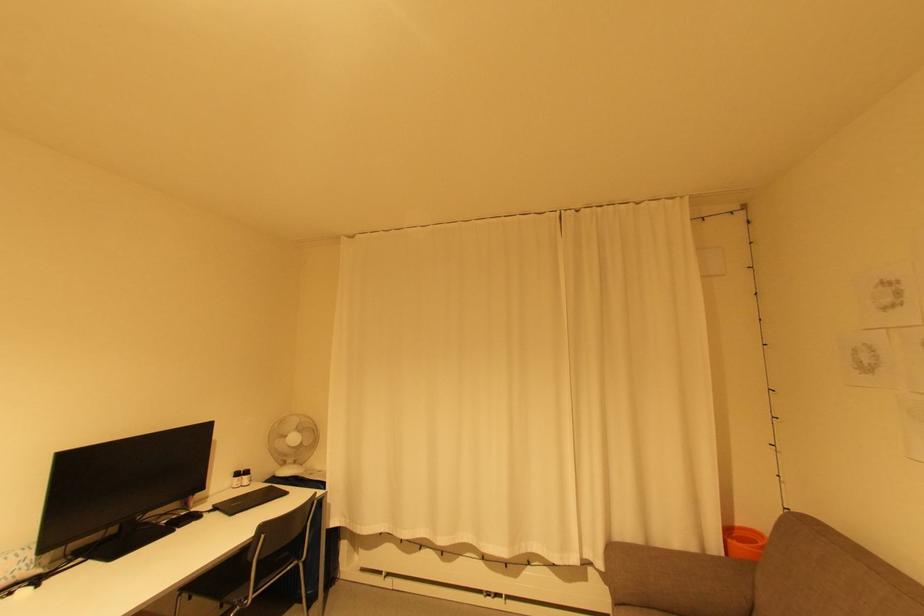
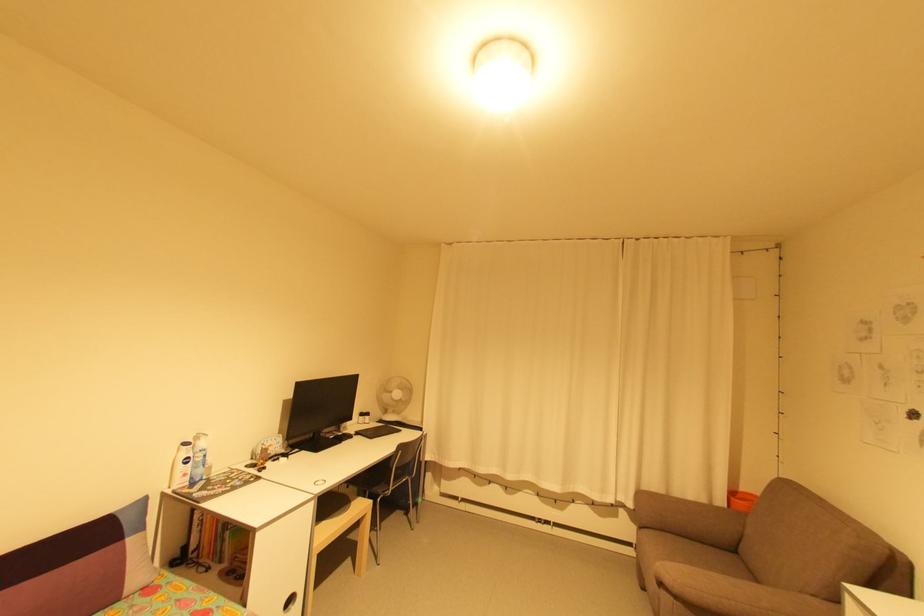
In a continuous first-person perspective shot, in which direction is the camera moving?

The movement direction of the cameraman is left, backward.